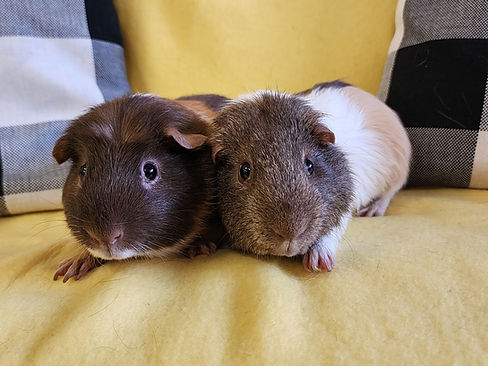
I want to click on white squares on throw pillows, so click(485, 156), click(52, 72), click(47, 199).